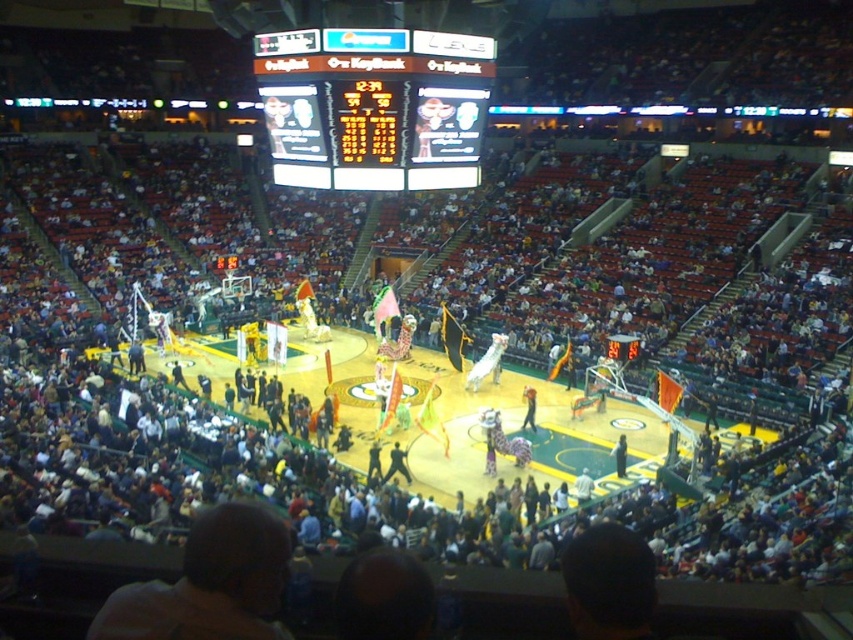
Question: Does white plastic scoreboard at upper center have a lesser width compared to metallic scoreboard at center?

Choices:
 (A) yes
 (B) no

Answer: (B)

Question: Which object appears closest to the camera in this image?

Choices:
 (A) white plastic scoreboard at upper center
 (B) metallic scoreboard at center

Answer: (A)

Question: Can you confirm if white plastic scoreboard at upper center is bigger than metallic scoreboard at center?

Choices:
 (A) yes
 (B) no

Answer: (A)

Question: Does white plastic scoreboard at upper center have a lesser width compared to metallic scoreboard at center?

Choices:
 (A) no
 (B) yes

Answer: (A)

Question: Which point is farther to the camera?

Choices:
 (A) white plastic scoreboard at upper center
 (B) metallic scoreboard at center

Answer: (B)